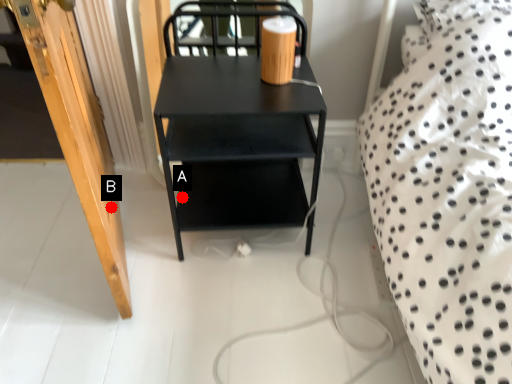
Question: Two points are circled on the image, labeled by A and B beside each circle. Which point is farther to the camera?

Choices:
 (A) A is further
 (B) B is further

Answer: (A)